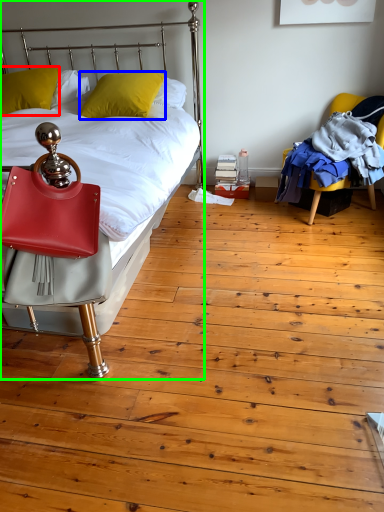
Question: Based on their relative distances, which object is farther from pillow (highlighted by a red box)? Choose from pillow (highlighted by a blue box) and bed (highlighted by a green box).

Choices:
 (A) pillow
 (B) bed

Answer: (B)